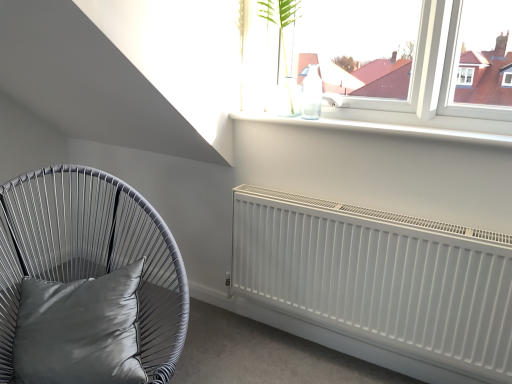
Question: Is white matte radiator at lower right at the right side of satin gray pillow at lower left?

Choices:
 (A) no
 (B) yes

Answer: (B)

Question: From the image's perspective, is white matte radiator at lower right on satin gray pillow at lower left?

Choices:
 (A) no
 (B) yes

Answer: (B)

Question: Is white matte radiator at lower right next to satin gray pillow at lower left and touching it?

Choices:
 (A) no
 (B) yes

Answer: (A)

Question: Is white matte radiator at lower right shorter than satin gray pillow at lower left?

Choices:
 (A) yes
 (B) no

Answer: (B)

Question: From a real-world perspective, does white matte radiator at lower right sit lower than satin gray pillow at lower left?

Choices:
 (A) no
 (B) yes

Answer: (B)

Question: Is point (375, 233) closer or farther from the camera than point (278, 8)?

Choices:
 (A) closer
 (B) farther

Answer: (A)

Question: Considering the positions of white matte radiator at lower right and translucent glass vase at upper center in the image, is white matte radiator at lower right wider or thinner than translucent glass vase at upper center?

Choices:
 (A) thin
 (B) wide

Answer: (A)

Question: From the image's perspective, is white matte radiator at lower right located above or below translucent glass vase at upper center?

Choices:
 (A) above
 (B) below

Answer: (B)

Question: From a real-world perspective, is white matte radiator at lower right physically located above or below translucent glass vase at upper center?

Choices:
 (A) below
 (B) above

Answer: (A)

Question: In the image, is translucent glass vase at upper center on the left side or the right side of white matte radiator at lower right?

Choices:
 (A) left
 (B) right

Answer: (A)

Question: Is translucent glass vase at upper center inside or outside of white matte radiator at lower right?

Choices:
 (A) outside
 (B) inside

Answer: (A)

Question: From their relative heights in the image, would you say translucent glass vase at upper center is taller or shorter than white matte radiator at lower right?

Choices:
 (A) tall
 (B) short

Answer: (B)

Question: Considering the positions of point tap(294, 3) and point tap(372, 327), is point tap(294, 3) closer or farther from the camera than point tap(372, 327)?

Choices:
 (A) closer
 (B) farther

Answer: (B)

Question: Is satin grey cushion at left in front of or behind translucent glass vase at upper center in the image?

Choices:
 (A) behind
 (B) front

Answer: (B)

Question: From a real-world perspective, relative to translucent glass vase at upper center, is satin grey cushion at left vertically above or below?

Choices:
 (A) below
 (B) above

Answer: (A)